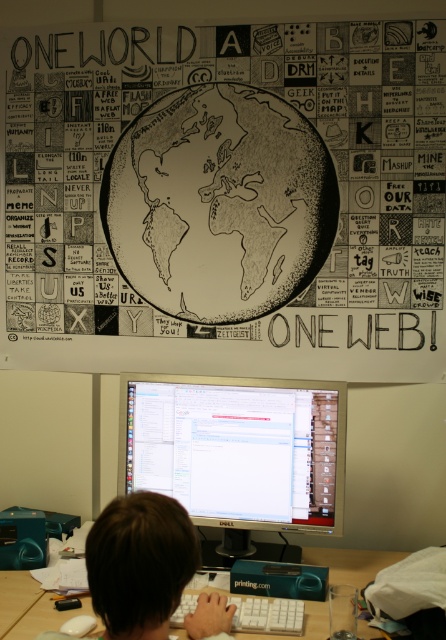
Question: Which point is farther to the camera?

Choices:
 (A) wooden at lower center
 (B) silver metallic monitor at center

Answer: (B)

Question: Which point is farther to the camera?

Choices:
 (A) (160, 444)
 (B) (375, 636)
 (C) (244, 612)
 (D) (115, 252)

Answer: (D)

Question: Which object is closer to the camera taking this photo?

Choices:
 (A) silver metallic monitor at center
 (B) black and white drawing of earth at upper center
 (C) white plastic keyboard at center
 (D) brown hair at center

Answer: (D)

Question: Observing the image, what is the correct spatial positioning of brown hair at center in reference to white plastic keyboard at center?

Choices:
 (A) left
 (B) right

Answer: (A)

Question: Can you confirm if silver metallic monitor at center is positioned to the right of wooden at lower center?

Choices:
 (A) yes
 (B) no

Answer: (B)

Question: Is black and white drawing of earth at upper center smaller than white plastic keyboard at center?

Choices:
 (A) yes
 (B) no

Answer: (B)